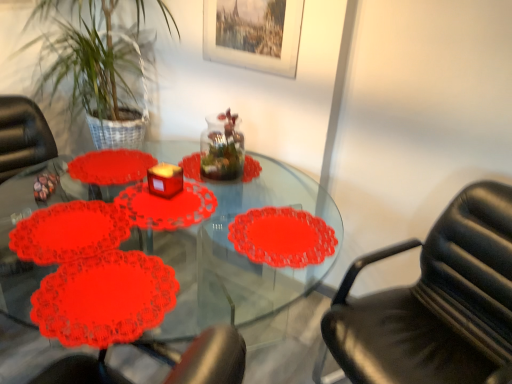
Question: Considering the relative positions of wooden picture frame at upper center and matte red candle at center in the image provided, is wooden picture frame at upper center to the left of matte red candle at center from the viewer's perspective?

Choices:
 (A) no
 (B) yes

Answer: (A)

Question: Is wooden picture frame at upper center to the right of matte red candle at center from the viewer's perspective?

Choices:
 (A) yes
 (B) no

Answer: (A)

Question: From the image's perspective, is wooden picture frame at upper center located beneath matte red candle at center?

Choices:
 (A) no
 (B) yes

Answer: (A)

Question: Considering the relative sizes of wooden picture frame at upper center and matte red candle at center in the image provided, is wooden picture frame at upper center taller than matte red candle at center?

Choices:
 (A) no
 (B) yes

Answer: (B)

Question: From a real-world perspective, is wooden picture frame at upper center located higher than matte red candle at center?

Choices:
 (A) yes
 (B) no

Answer: (A)

Question: Based on their positions, is lacy paper doily at lower left located to the left or right of green leafy plant at upper left?

Choices:
 (A) left
 (B) right

Answer: (B)

Question: From a real-world perspective, relative to green leafy plant at upper left, is lacy paper doily at lower left vertically above or below?

Choices:
 (A) below
 (B) above

Answer: (A)

Question: Is lacy paper doily at lower left in front of or behind green leafy plant at upper left in the image?

Choices:
 (A) front
 (B) behind

Answer: (A)

Question: Looking at the image, does lacy paper doily at lower left seem bigger or smaller compared to green leafy plant at upper left?

Choices:
 (A) small
 (B) big

Answer: (A)

Question: Considering the relative positions of transparent glass jar at center and green leafy plant at upper left in the image provided, is transparent glass jar at center to the left or to the right of green leafy plant at upper left?

Choices:
 (A) left
 (B) right

Answer: (B)

Question: Is point (211, 167) positioned closer to the camera than point (111, 96)?

Choices:
 (A) farther
 (B) closer

Answer: (B)

Question: Relative to green leafy plant at upper left, is transparent glass jar at center in front or behind?

Choices:
 (A) front
 (B) behind

Answer: (B)

Question: In terms of height, does transparent glass jar at center look taller or shorter compared to green leafy plant at upper left?

Choices:
 (A) tall
 (B) short

Answer: (B)

Question: In terms of size, does transparent glass jar at center appear bigger or smaller than lacy paper doily at lower left?

Choices:
 (A) big
 (B) small

Answer: (A)

Question: Considering the positions of transparent glass jar at center and lacy paper doily at lower left in the image, is transparent glass jar at center taller or shorter than lacy paper doily at lower left?

Choices:
 (A) tall
 (B) short

Answer: (A)